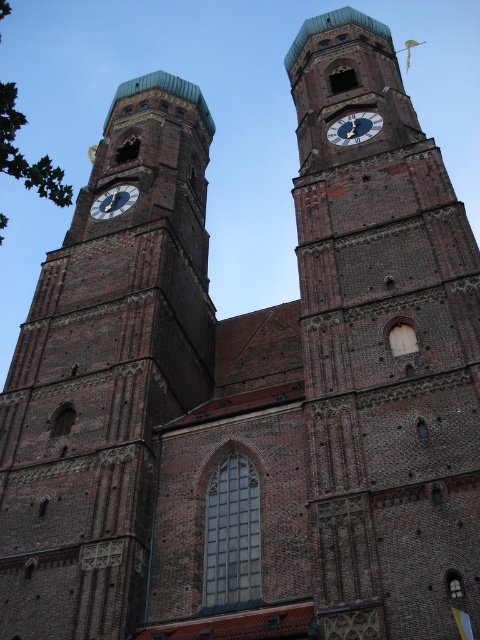
Which is above, brown brick clock tower at center or gold metallic clock at upper center?

gold metallic clock at upper center is higher up.

Between point (309, 195) and point (369, 125), which one is positioned behind?

The point (369, 125) is behind.

Find the location of a particular element. The width and height of the screenshot is (480, 640). brown brick clock tower at center is located at coordinates (384, 348).

Does gold metallic clock at upper center have a lesser height compared to gold metallic clock at left?

Yes.

Can you confirm if gold metallic clock at upper center is positioned above gold metallic clock at left?

Indeed, gold metallic clock at upper center is positioned over gold metallic clock at left.

Locate an element on the screen. This screenshot has width=480, height=640. gold metallic clock at upper center is located at coordinates (355, 128).

Can you confirm if brown brick clock tower at center is positioned above brown brick clock tower at left?

Correct, brown brick clock tower at center is located above brown brick clock tower at left.

Who is positioned more to the left, brown brick clock tower at center or brown brick clock tower at left?

brown brick clock tower at left is more to the left.

Locate an element on the screen. brown brick clock tower at center is located at coordinates (384, 348).

Where is `brown brick clock tower at center`? brown brick clock tower at center is located at coordinates (384, 348).